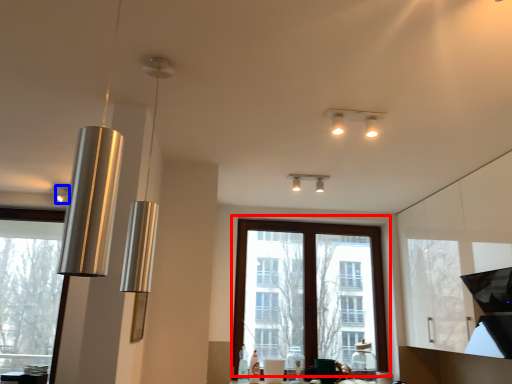
Question: Which of the following is the closest to the observer, window (highlighted by a red box) or lamp (highlighted by a blue box)?

Choices:
 (A) window
 (B) lamp

Answer: (B)